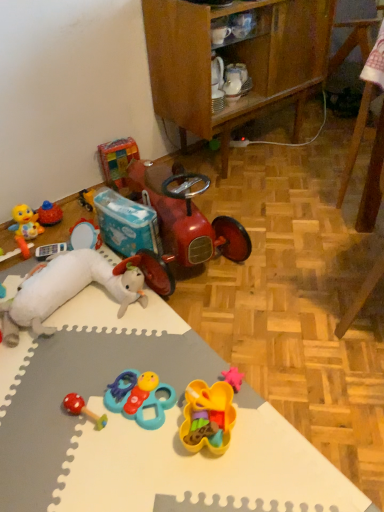
What are the coordinates of `vacant space in front of shiny red toy car at center` in the screenshot? It's located at (204, 332).